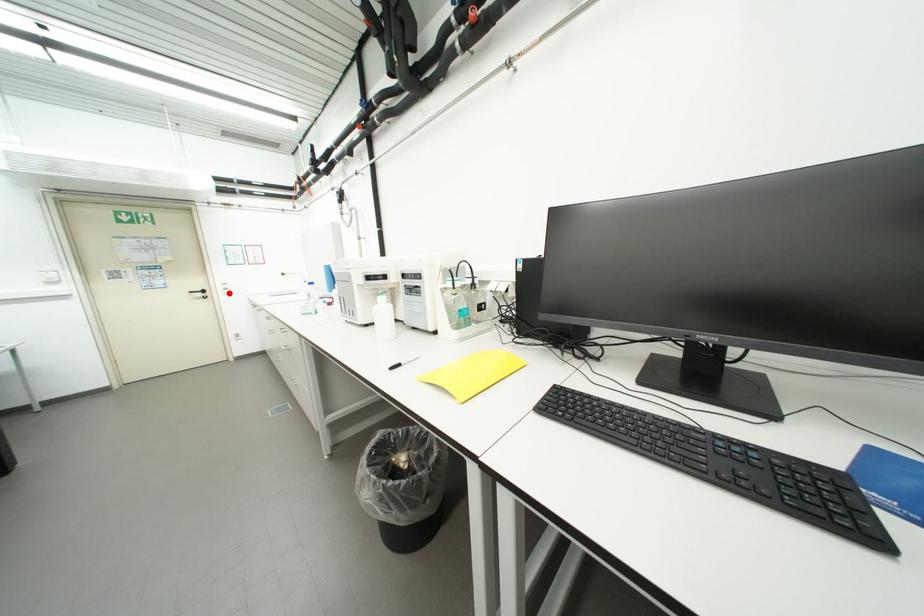
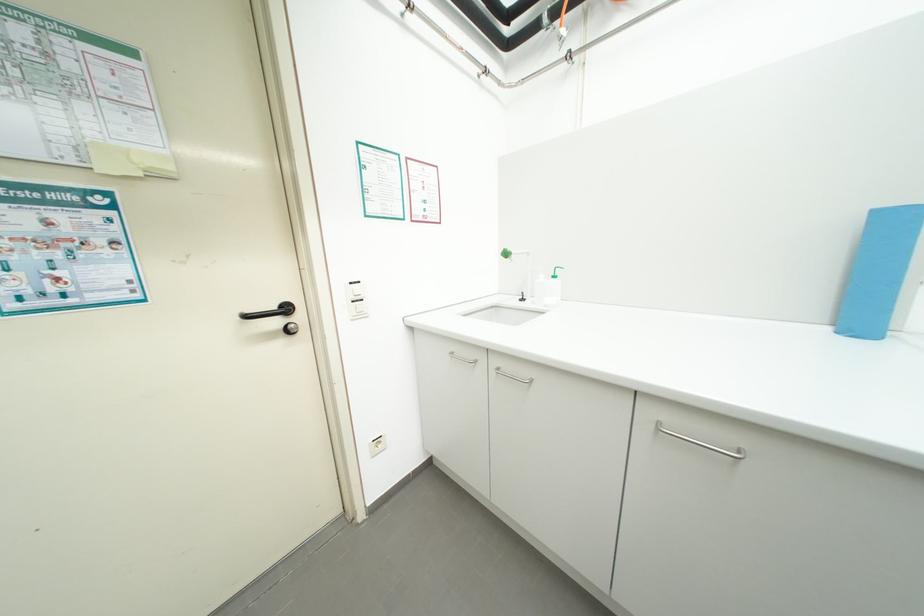
Locate, in the second image, the point that corresponds to the highlighted location in the first image.

(351, 312)